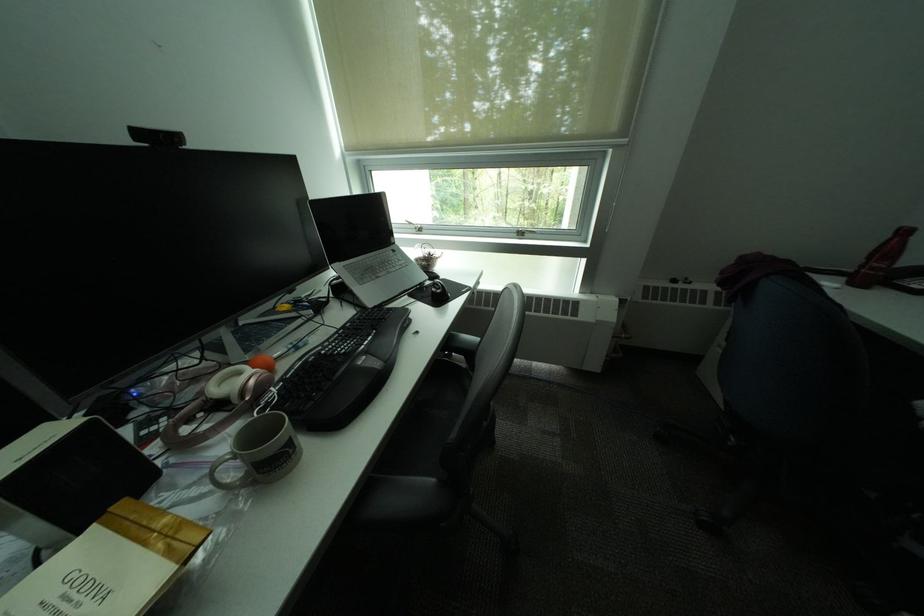
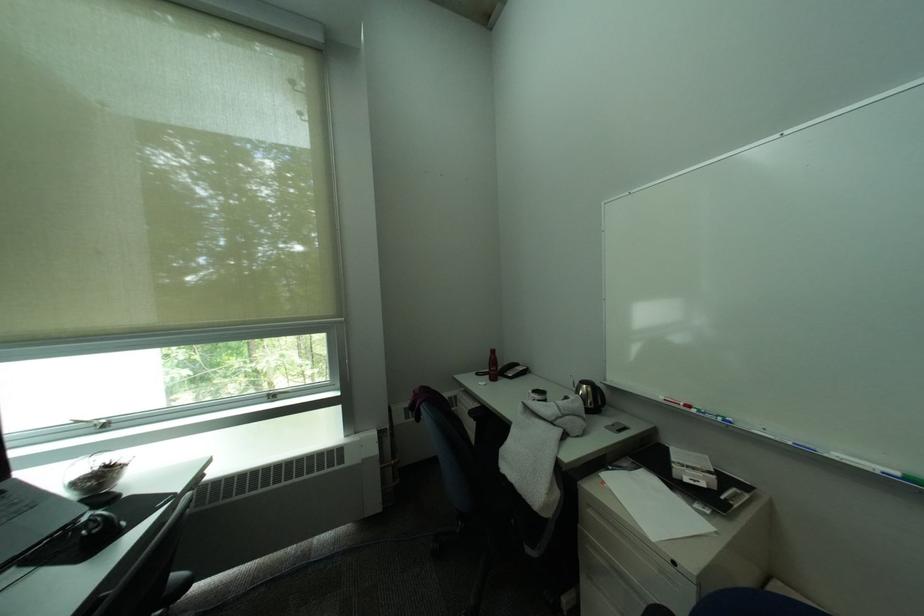
In the second image, find the point that corresponds to (x=428, y=262) in the first image.

(84, 485)